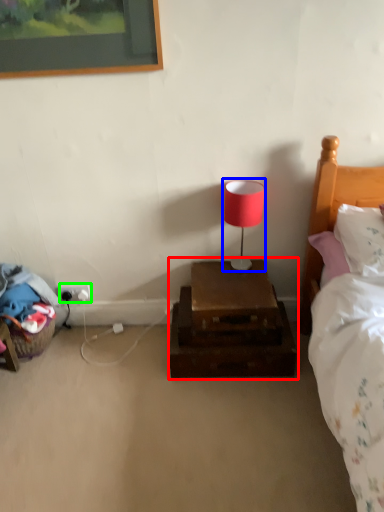
Question: Which object is positioned closest to nightstand (highlighted by a red box)? Select from table lamp (highlighted by a blue box) and electric outlet (highlighted by a green box).

Choices:
 (A) table lamp
 (B) electric outlet

Answer: (A)